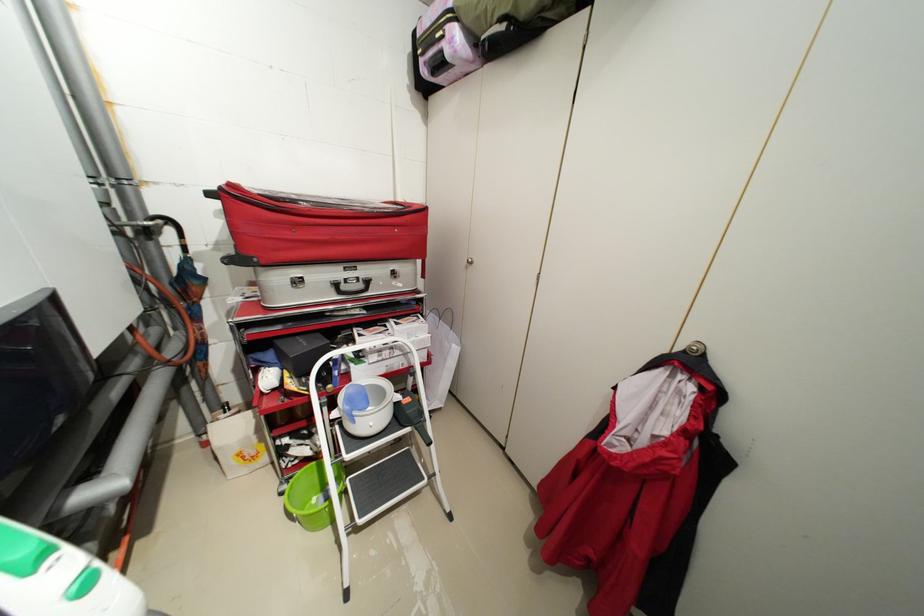
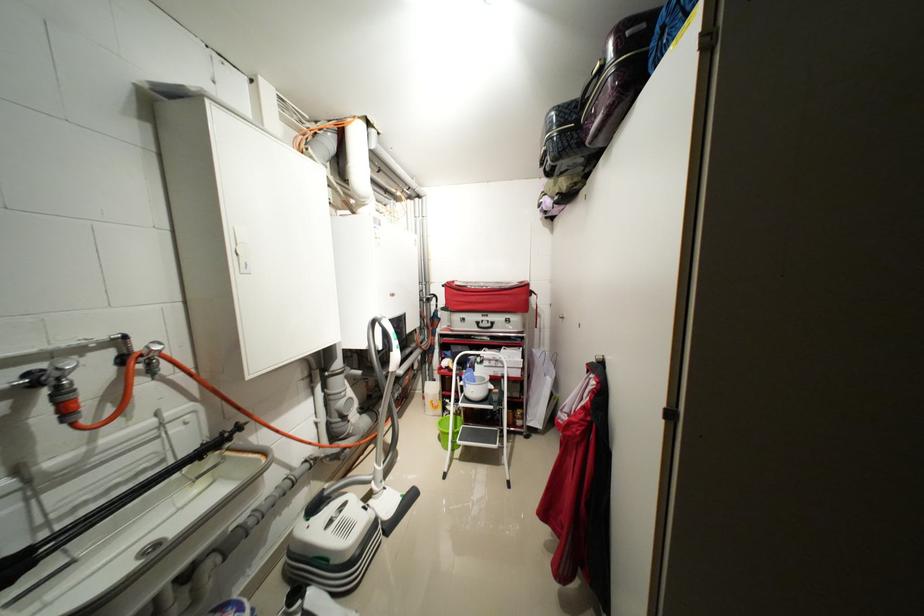
Where in the second image is the point corresponding to the point at 386,352 from the first image?

(496, 361)